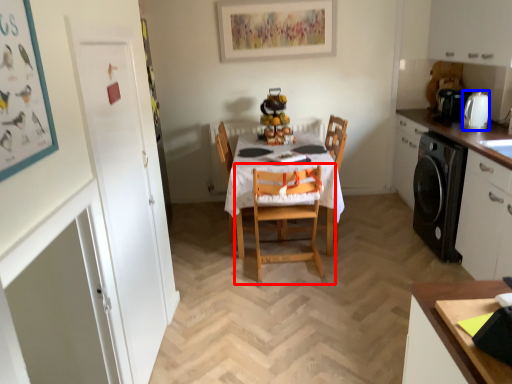
Question: Which of the following is the closest to the observer, chair (highlighted by a red box) or appliance (highlighted by a blue box)?

Choices:
 (A) chair
 (B) appliance

Answer: (A)